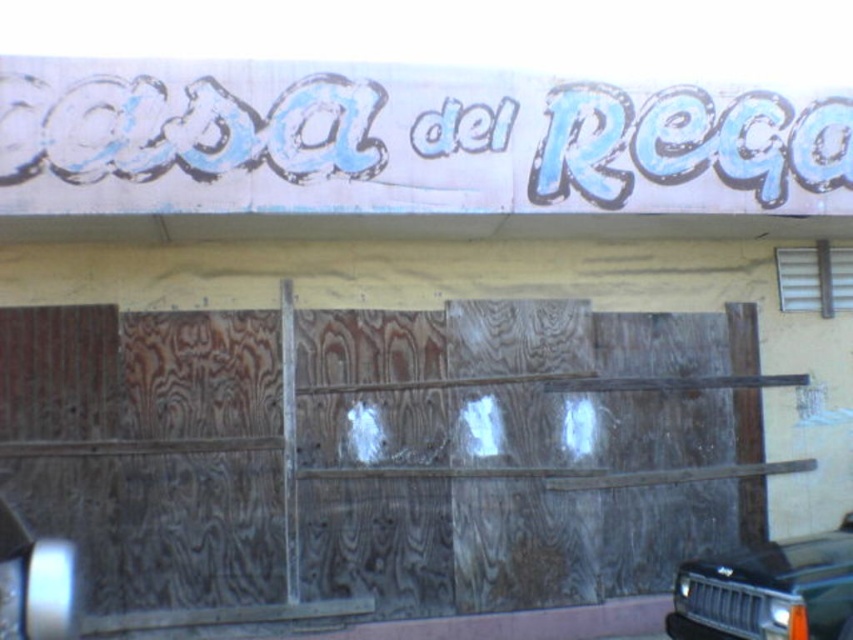
Question: Among these objects, which one is nearest to the camera?

Choices:
 (A) black matte car at lower right
 (B) blue painted sign at upper center

Answer: (A)

Question: Is weathered wood garage door at center thinner than blue painted sign at upper center?

Choices:
 (A) yes
 (B) no

Answer: (B)

Question: Considering the relative positions of weathered wood garage door at center and blue painted sign at upper center in the image provided, where is weathered wood garage door at center located with respect to blue painted sign at upper center?

Choices:
 (A) right
 (B) left

Answer: (B)

Question: Among these points, which one is farthest from the camera?

Choices:
 (A) (761, 129)
 (B) (352, 545)

Answer: (B)

Question: Among these points, which one is nearest to the camera?

Choices:
 (A) (648, 96)
 (B) (726, 321)
 (C) (714, 609)

Answer: (C)

Question: Can you confirm if blue painted sign at upper center is positioned above black matte car at lower right?

Choices:
 (A) no
 (B) yes

Answer: (B)